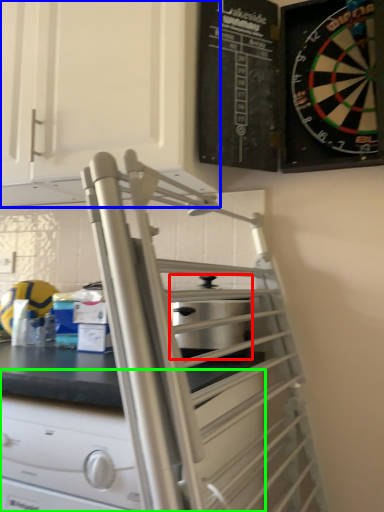
Question: Estimate the real-world distances between objects in this image. Which object is farther from appliance (highlighted by a red box), cabinetry (highlighted by a blue box) or drawer (highlighted by a green box)?

Choices:
 (A) cabinetry
 (B) drawer

Answer: (A)